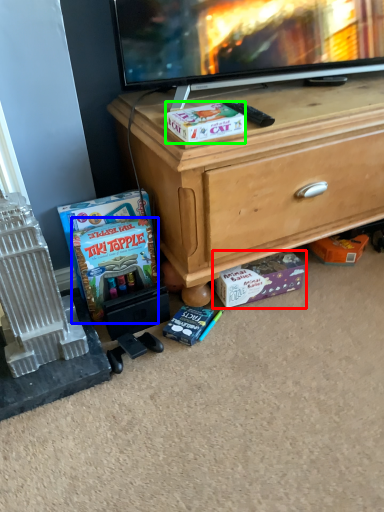
Question: Which is farther away from cardboard box (highlighted by a red box)? comic book (highlighted by a blue box) or box (highlighted by a green box)?

Choices:
 (A) comic book
 (B) box

Answer: (B)